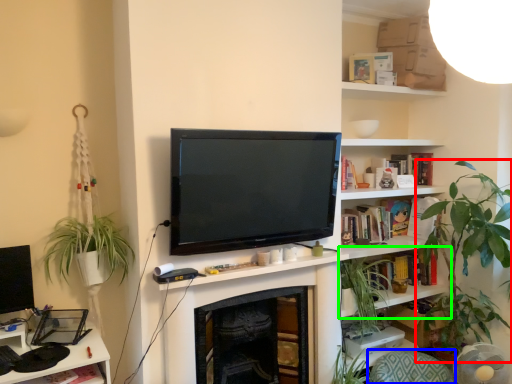
Question: Based on their relative distances, which object is farther from houseplant (highlighted by a red box)? Choose from swivel chair (highlighted by a blue box) and shelf (highlighted by a green box).

Choices:
 (A) swivel chair
 (B) shelf

Answer: (A)